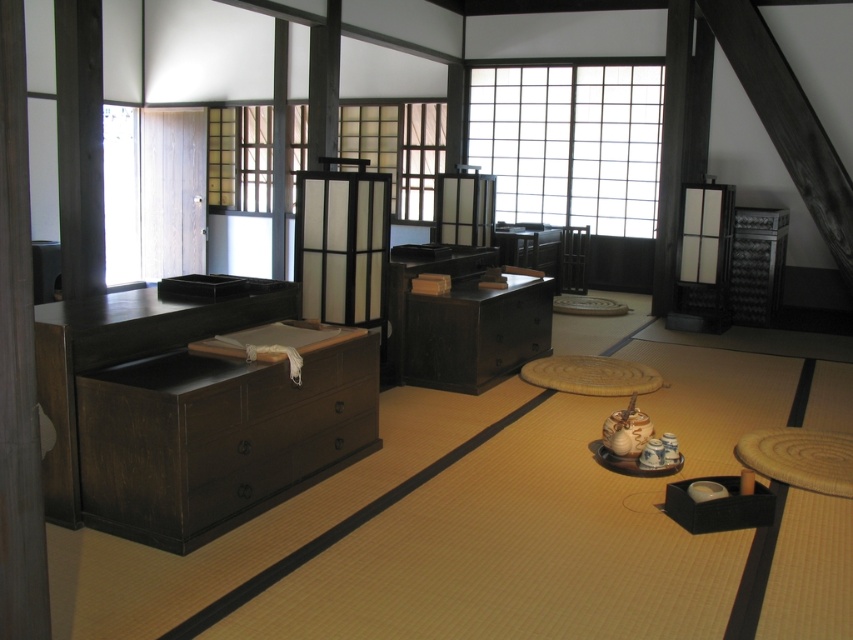
You are standing in the traditional Japanese room and want to place a small decorative item between the two points labeled as point (219,508) and point (538,349). Given that the item must be placed closer to the point that is nearer to you, where should you position it?

You should position the decorative item closer to point (219,508) because it is nearer to you than point (538,349).

What are the coordinates of the dark wood dresser at left in the image?

The dark wood dresser at left is located at coordinates point (190, 410).